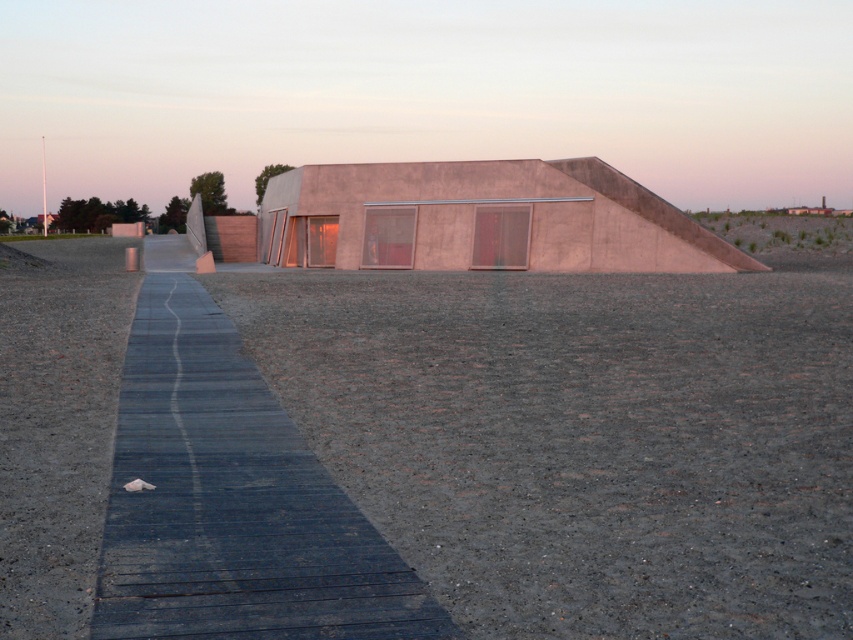
You are a landscape architect planning to install a new walkway between the gray gravel at center and the dark gray wooden path at center. Which material has a larger particle size that might affect the walkway design?

The gray gravel at center has a larger size compared to the dark gray wooden path at center, so it might require adjustments in the walkway design to accommodate the larger particles.

You are standing at the entrance of the modern architectural structure and want to reach a specific location. You have two points marked on your map, point (659, 294) and point (167, 518). According to the scene, which point is closer to the building?

Point (167, 518) is closer to the building because the description states that point (659, 294) is behind point (167, 518), meaning it is farther away from the building.

You are a landscape architect designing a walking route between the gray gravel at center and the dark gray wooden path at center. Which material area is wider to accommodate more visitors?

The gray gravel at center is wider than the dark gray wooden path at center, so it can accommodate more visitors.